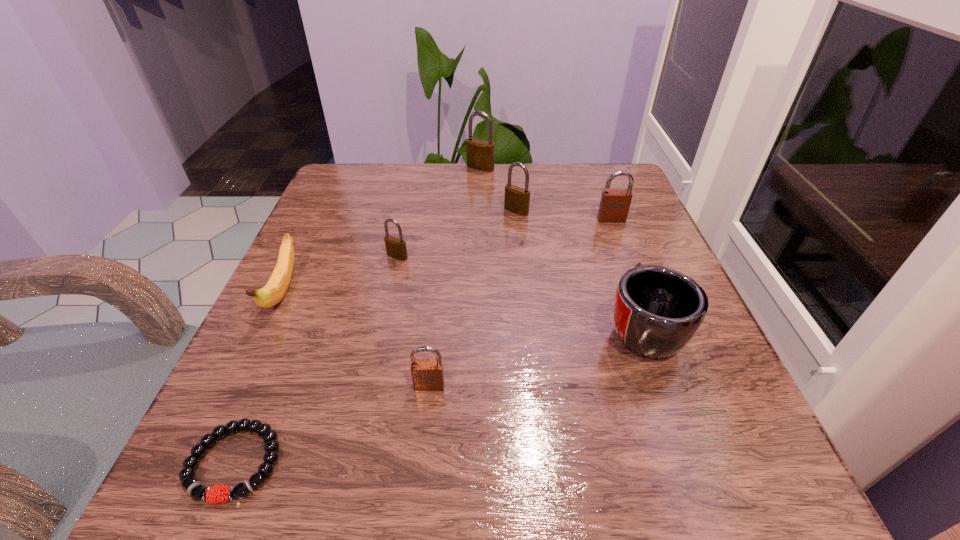
Where is `free spot located on the right of the smallest brass padlock`? free spot located on the right of the smallest brass padlock is located at coordinates pos(458,256).

At what (x,y) coordinates should I click in order to perform the action: click on vacant space located 0.070m on the front-facing side of the second padlock from left to right. Please return your answer as a coordinate pair (x, y). Looking at the image, I should click on (424, 435).

Identify the location of vacant space located 0.120m at the stem of the banana. (236, 390).

The height and width of the screenshot is (540, 960). I want to click on free space located 0.080m on the back of the shortest object, so click(x=272, y=375).

Image resolution: width=960 pixels, height=540 pixels. I want to click on object located at the near edge, so click(x=218, y=494).

This screenshot has width=960, height=540. I want to click on banana at the left edge, so click(x=273, y=292).

Identify the location of bracelet situated at the left edge. This screenshot has height=540, width=960. (218, 494).

This screenshot has height=540, width=960. Find the location of `padlock that is at the right edge`. padlock that is at the right edge is located at coordinates (614, 206).

Find the location of a particular element. The image size is (960, 540). mug present at the right edge is located at coordinates (657, 310).

At what (x,y) coordinates should I click in order to perform the action: click on object positioned at the near left corner. Please return your answer as a coordinate pair (x, y). This screenshot has width=960, height=540. Looking at the image, I should click on (218, 494).